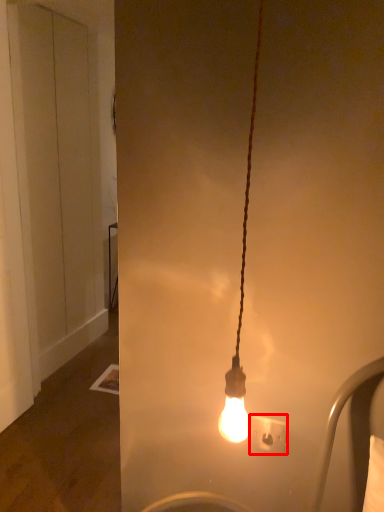
Question: In this image, where is power plugs and sockets (annotated by the red box) located relative to door?

Choices:
 (A) left
 (B) right

Answer: (B)